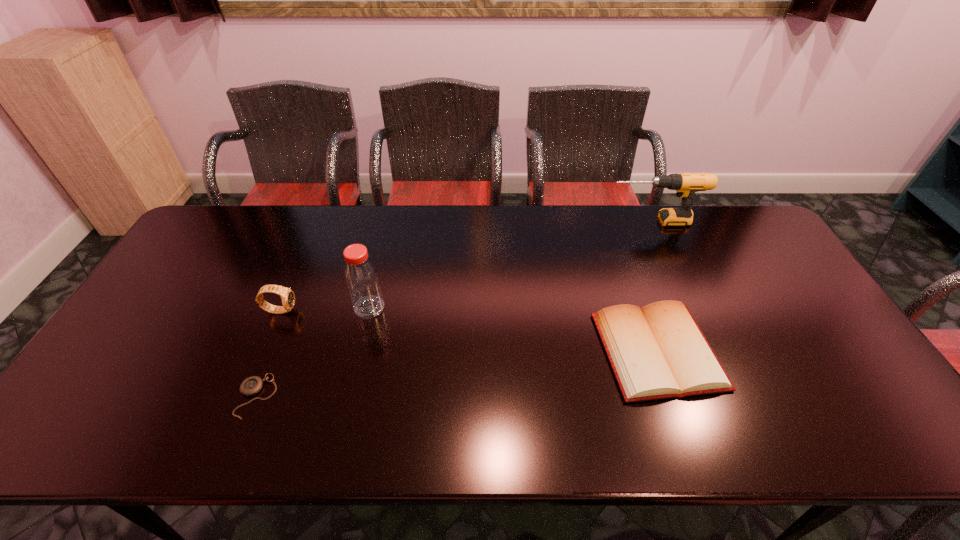
Identify the location of bottle. The width and height of the screenshot is (960, 540). (362, 280).

The width and height of the screenshot is (960, 540). In order to click on drill in this screenshot , I will do `click(686, 184)`.

Locate an element on the screen. The image size is (960, 540). watch is located at coordinates [288, 298].

Find the location of a particular element. The image size is (960, 540). Bible is located at coordinates (659, 351).

Locate an element on the screen. This screenshot has width=960, height=540. the shortest object is located at coordinates (252, 385).

The width and height of the screenshot is (960, 540). In order to click on free spot located on the right of the third object from left to right in this screenshot , I will do `click(512, 307)`.

Locate an element on the screen. vacant region located on the handle side of the drill is located at coordinates (547, 221).

This screenshot has width=960, height=540. I want to click on vacant region located on the handle side of the drill, so click(562, 221).

Image resolution: width=960 pixels, height=540 pixels. I want to click on free spot located 0.060m on the handle side of the drill, so click(590, 221).

This screenshot has width=960, height=540. In order to click on free space located on the face of the third tallest object in this screenshot , I will do `click(324, 310)`.